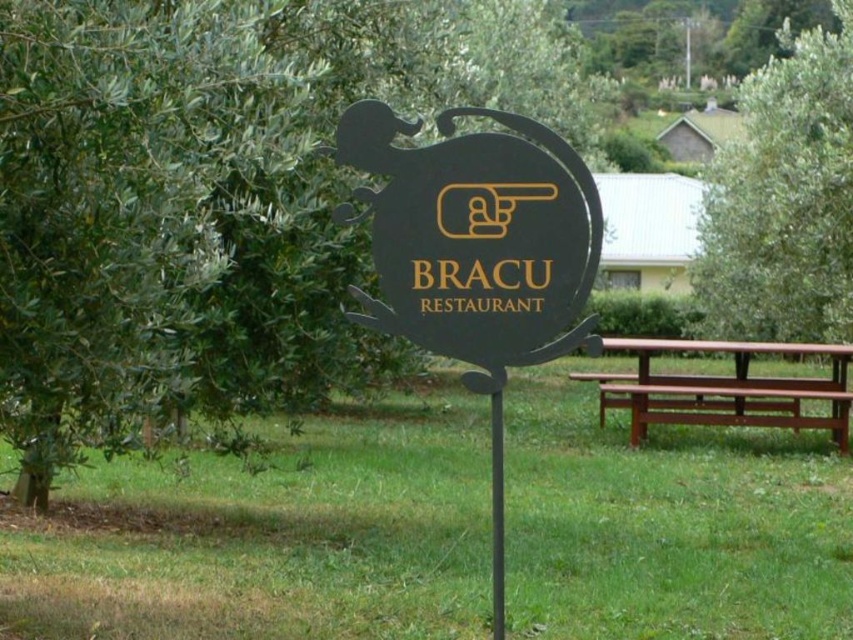
You are standing at the sign for BRACU Restaurant. You see a point marked at coordinates point [212,195]. What is located at that point?

The point [212,195] marks a green leafy tree at center.